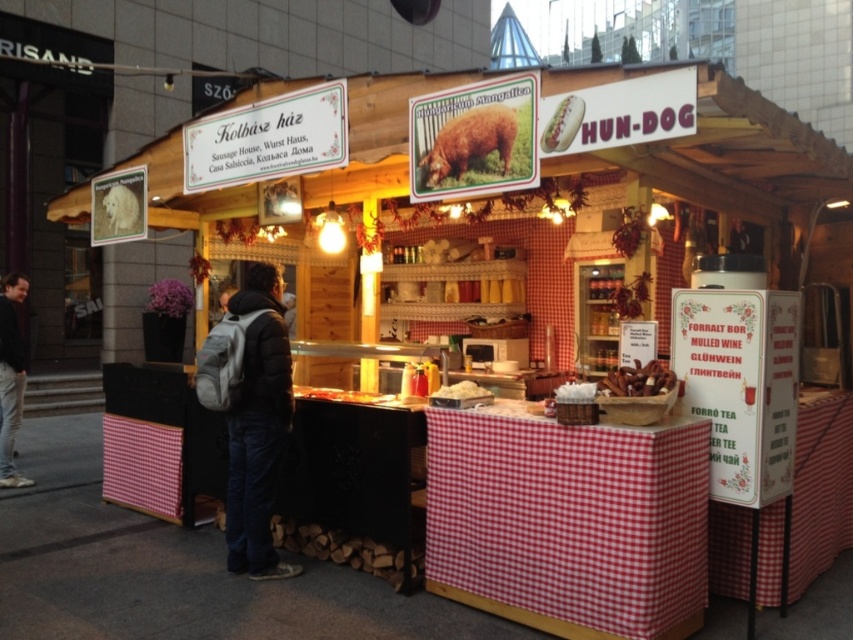
You are a customer standing at the entrance of the HUN DOG food stall. You notice two points marked on the stall structure. The first point is at coordinates point [271,308] and the second is at point [614,378]. If you want to reach the point that is closer to you, which one should you head towards?

You should head towards point [271,308] because it is closer to you than point [614,378].